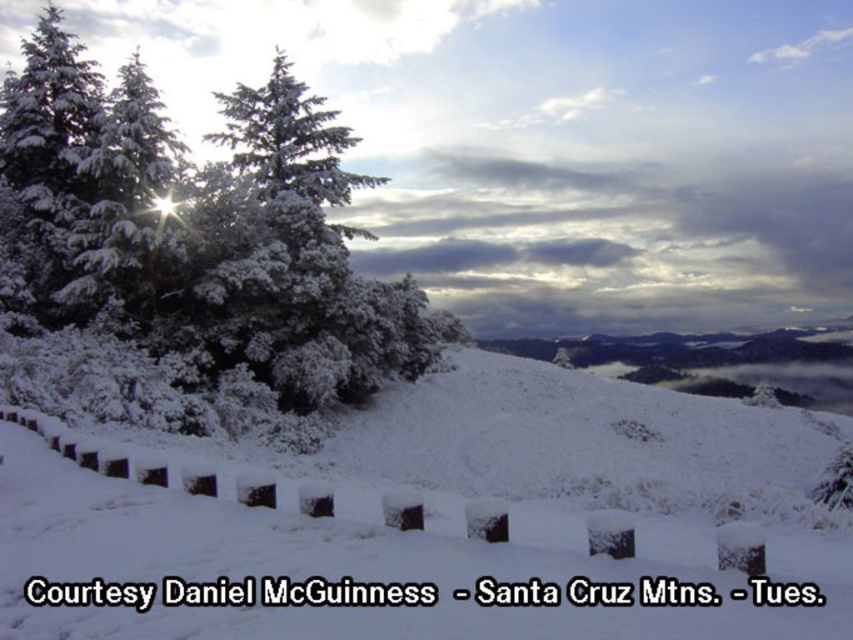
Image resolution: width=853 pixels, height=640 pixels. Describe the element at coordinates (450, 512) in the screenshot. I see `white matte snow at center` at that location.

Can you confirm if white matte snow at center is smaller than snow-covered evergreen at upper left?

Indeed, white matte snow at center has a smaller size compared to snow-covered evergreen at upper left.

This screenshot has width=853, height=640. Find the location of `white matte snow at center`. white matte snow at center is located at coordinates (450, 512).